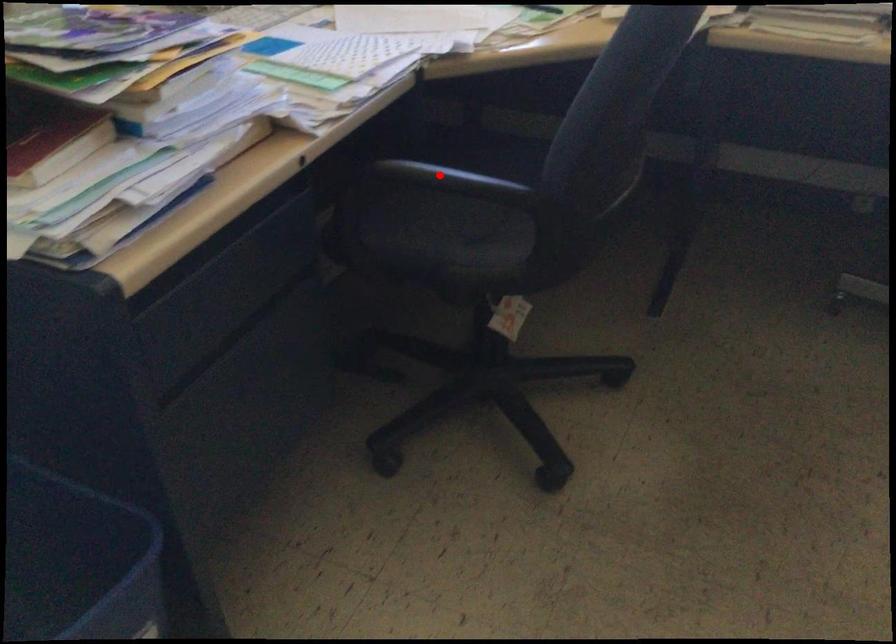
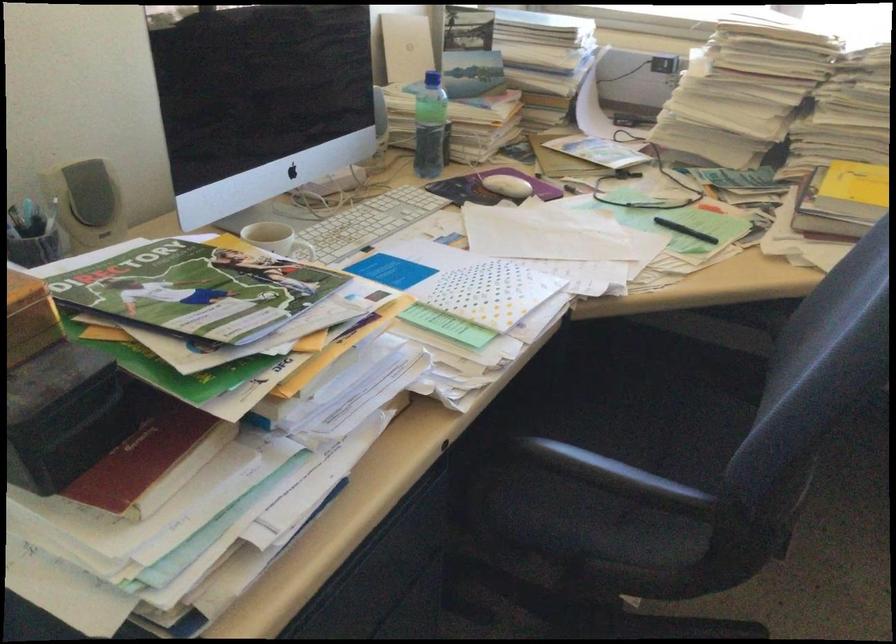
Question: I am providing you with two images of the same scene from different viewpoints. In image1, a red point is highlighted. Considering the same 3D point in image2, which of the following is correct?

Choices:
 (A) It is closer
 (B) It is farther

Answer: (A)